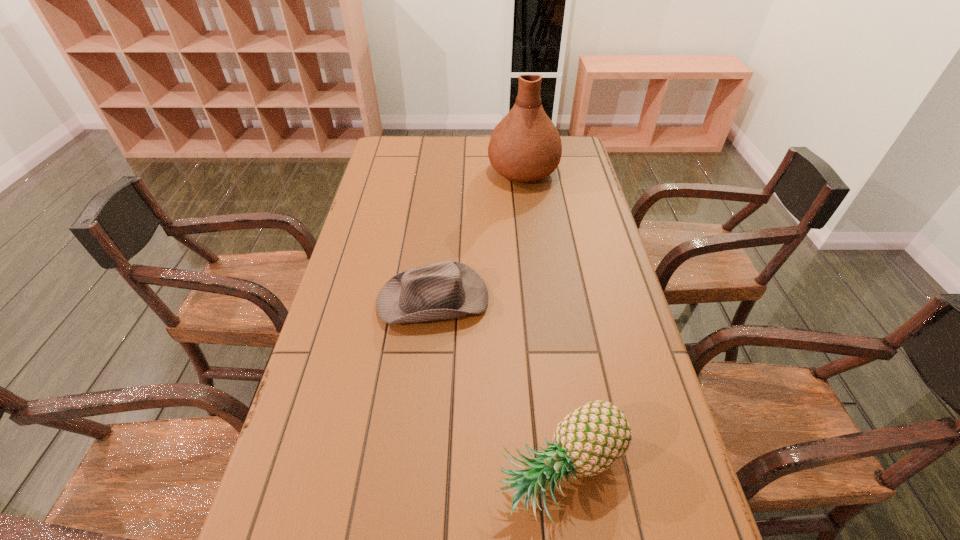
Find the location of a particular element. free space between the farthest object and the pineapple is located at coordinates (542, 322).

This screenshot has width=960, height=540. In order to click on free space between the tallest object and the shortest object in this screenshot , I will do `click(478, 235)`.

Locate an element on the screen. This screenshot has height=540, width=960. vacant space that is in between the farthest object and the pineapple is located at coordinates (542, 322).

At what (x,y) coordinates should I click in order to perform the action: click on free space between the second tallest object and the tallest object. Please return your answer as a coordinate pair (x, y). Looking at the image, I should click on (542, 322).

You are a GUI agent. You are given a task and a screenshot of the screen. Output one action in this format:
    pyautogui.click(x=<x>, y=<y>)
    Task: Click on the vacant space that is in between the leftmost object and the pitcher
    This screenshot has width=960, height=540.
    Given the screenshot: What is the action you would take?
    click(x=478, y=235)

Where is `vacant region between the farthest object and the second shortest object`? The width and height of the screenshot is (960, 540). vacant region between the farthest object and the second shortest object is located at coordinates (542, 322).

Find the location of a particular element. Image resolution: width=960 pixels, height=540 pixels. free space that is in between the farthest object and the nearest object is located at coordinates (542, 322).

Where is `blank region between the tallest object and the second tallest object`? This screenshot has height=540, width=960. blank region between the tallest object and the second tallest object is located at coordinates (542, 322).

The width and height of the screenshot is (960, 540). What are the coordinates of `object that ranks as the second closest to the second shortest object` in the screenshot? It's located at (525, 146).

Identify the location of object that ranks as the second closest to the second nearest object. The image size is (960, 540). (525, 146).